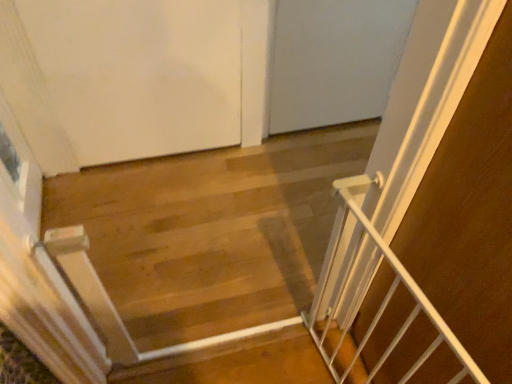
Question: From a real-world perspective, is white metal gate at center physically located above or below white matte door at upper left?

Choices:
 (A) below
 (B) above

Answer: (A)

Question: In the image, is white metal gate at center positioned in front of or behind white matte door at upper left?

Choices:
 (A) behind
 (B) front

Answer: (B)

Question: Which object is the farthest from the white metal gate at right?

Choices:
 (A) white metal gate at center
 (B) white matte door at upper left

Answer: (B)

Question: Which object is positioned closest to the white metal gate at right?

Choices:
 (A) white matte door at upper left
 (B) white metal gate at center

Answer: (B)